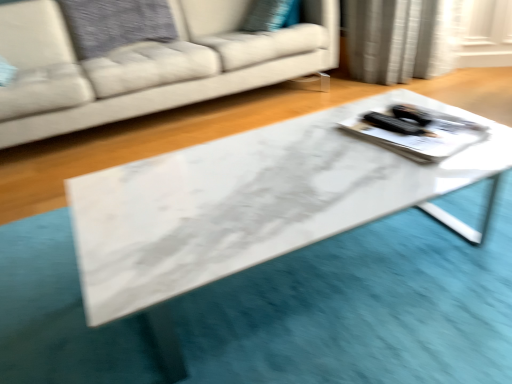
You are a GUI agent. You are given a task and a screenshot of the screen. Output one action in this format:
    pyautogui.click(x=<x>, y=<y>)
    Task: Click on the free space in front of white glossy tray at center
    
    Given the screenshot: What is the action you would take?
    pyautogui.click(x=404, y=176)